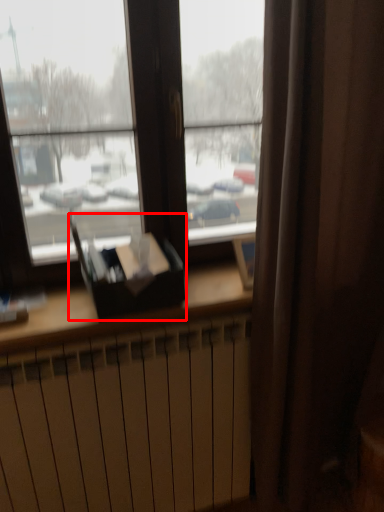
Question: Observing the image, what is the correct spatial positioning of paperback book (annotated by the red box) in reference to radiator?

Choices:
 (A) right
 (B) left

Answer: (B)